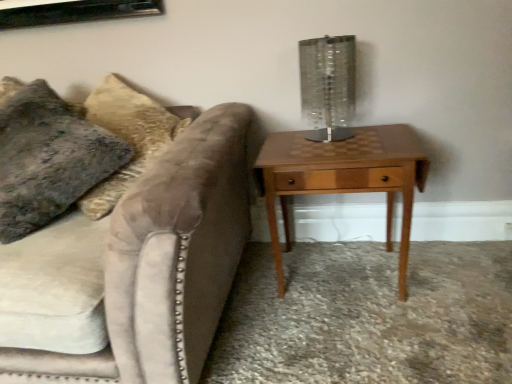
Question: Does velvety gray pillow at left have a larger size compared to woodenmaterial/texturenightstand at right?

Choices:
 (A) no
 (B) yes

Answer: (B)

Question: Is velvety gray pillow at left beside woodenmaterial/texturenightstand at right?

Choices:
 (A) no
 (B) yes

Answer: (A)

Question: Can you confirm if velvety gray pillow at left is wider than woodenmaterial/texturenightstand at right?

Choices:
 (A) no
 (B) yes

Answer: (B)

Question: Is velvety gray pillow at left positioned before woodenmaterial/texturenightstand at right?

Choices:
 (A) no
 (B) yes

Answer: (B)

Question: Is woodenmaterial/texturenightstand at right at the back of velvety gray pillow at left?

Choices:
 (A) no
 (B) yes

Answer: (A)

Question: In terms of height, does velvety gray pillow at left look taller or shorter compared to woodenmaterial/texturenightstand at right?

Choices:
 (A) tall
 (B) short

Answer: (A)

Question: Looking at their shapes, would you say velvety gray pillow at left is wider or thinner than woodenmaterial/texturenightstand at right?

Choices:
 (A) wide
 (B) thin

Answer: (A)

Question: From the image's perspective, is velvety gray pillow at left above or below woodenmaterial/texturenightstand at right?

Choices:
 (A) below
 (B) above

Answer: (B)

Question: Do you think velvety gray pillow at left is within woodenmaterial/texturenightstand at right, or outside of it?

Choices:
 (A) inside
 (B) outside

Answer: (B)

Question: Looking at the image, does velvet couch at left seem bigger or smaller compared to woodenmaterial/texturenightstand at right?

Choices:
 (A) small
 (B) big

Answer: (B)

Question: From a real-world perspective, is velvet couch at left physically located above or below woodenmaterial/texturenightstand at right?

Choices:
 (A) below
 (B) above

Answer: (B)

Question: From the image's perspective, relative to woodenmaterial/texturenightstand at right, is velvet couch at left above or below?

Choices:
 (A) below
 (B) above

Answer: (A)

Question: Is velvet couch at left inside the boundaries of woodenmaterial/texturenightstand at right, or outside?

Choices:
 (A) outside
 (B) inside

Answer: (A)

Question: Is clear glass table lamp at upper right situated inside woodenmaterial/texturenightstand at right or outside?

Choices:
 (A) outside
 (B) inside

Answer: (A)

Question: Looking at their shapes, would you say clear glass table lamp at upper right is wider or thinner than woodenmaterial/texturenightstand at right?

Choices:
 (A) wide
 (B) thin

Answer: (B)